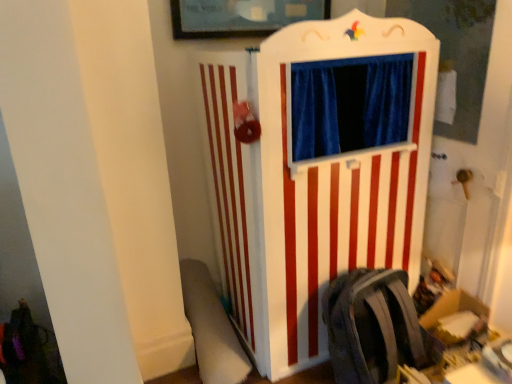
Question: From a real-world perspective, is white wood puppet theater at center located higher than matte gray backpack at lower right?

Choices:
 (A) no
 (B) yes

Answer: (B)

Question: Is white wood puppet theater at center thinner than matte gray backpack at lower right?

Choices:
 (A) yes
 (B) no

Answer: (B)

Question: Is white wood puppet theater at center beside matte gray backpack at lower right?

Choices:
 (A) yes
 (B) no

Answer: (B)

Question: Could matte gray backpack at lower right be considered to be inside white wood puppet theater at center?

Choices:
 (A) no
 (B) yes

Answer: (A)

Question: From the image's perspective, is white wood puppet theater at center above matte gray backpack at lower right?

Choices:
 (A) yes
 (B) no

Answer: (A)

Question: Is white wood puppet theater at center aimed at matte gray backpack at lower right?

Choices:
 (A) yes
 (B) no

Answer: (A)

Question: Does white wood puppet theater at center have a lesser height compared to white plush swivel chair at lower left?

Choices:
 (A) no
 (B) yes

Answer: (A)

Question: Considering the relative positions of white wood puppet theater at center and white plush swivel chair at lower left in the image provided, is white wood puppet theater at center behind white plush swivel chair at lower left?

Choices:
 (A) yes
 (B) no

Answer: (B)

Question: Is white plush swivel chair at lower left inside white wood puppet theater at center?

Choices:
 (A) yes
 (B) no

Answer: (B)

Question: From the image's perspective, is white wood puppet theater at center on white plush swivel chair at lower left?

Choices:
 (A) yes
 (B) no

Answer: (A)

Question: Is white wood puppet theater at center not within white plush swivel chair at lower left?

Choices:
 (A) no
 (B) yes

Answer: (B)

Question: Is the position of white wood puppet theater at center less distant than that of white plush swivel chair at lower left?

Choices:
 (A) yes
 (B) no

Answer: (A)

Question: Is white plush swivel chair at lower left smaller than white wood puppet theater at center?

Choices:
 (A) no
 (B) yes

Answer: (B)